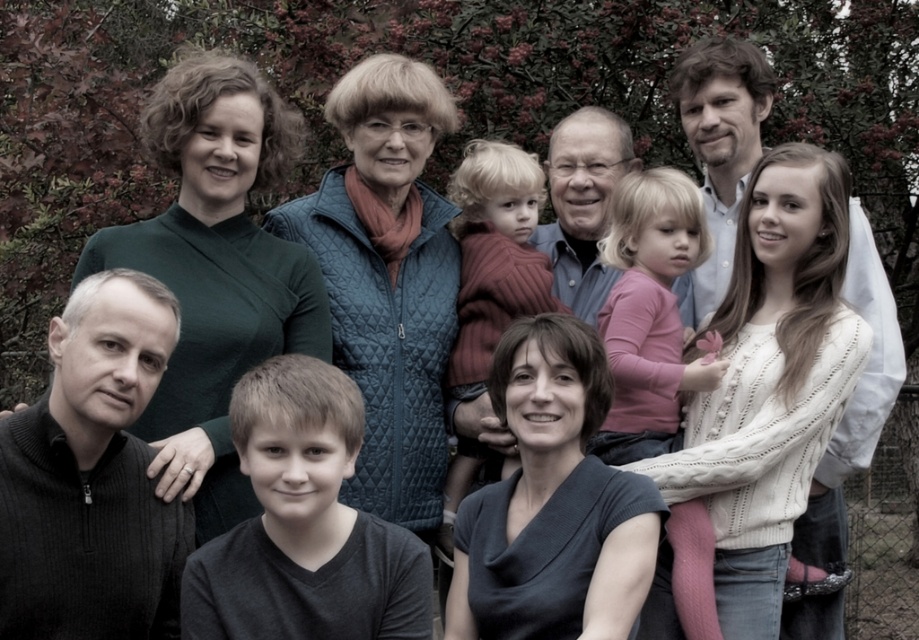
How far apart are dark gray v-neck shirt at lower left and pink sweater at center?

2.20 meters

Who is taller, dark gray v-neck shirt at lower left or pink sweater at center?

pink sweater at center

The height and width of the screenshot is (640, 919). In order to click on dark gray v-neck shirt at lower left in this screenshot , I will do `click(304, 524)`.

Is dark gray v-neck shirt at lower left positioned before maroon knitted sweater at center?

Yes, it is.

Between dark gray v-neck shirt at lower left and maroon knitted sweater at center, which one appears on the left side from the viewer's perspective?

dark gray v-neck shirt at lower left is more to the left.

Is point (271, 452) less distant than point (472, 445)?

That is True.

The height and width of the screenshot is (640, 919). What are the coordinates of `dark gray v-neck shirt at lower left` in the screenshot? It's located at (304, 524).

Which is in front, point (600, 257) or point (457, 216)?

Point (600, 257) is in front.

Can you confirm if pink sweater at center is positioned to the right of maroon knitted sweater at center?

Correct, you'll find pink sweater at center to the right of maroon knitted sweater at center.

Image resolution: width=919 pixels, height=640 pixels. Identify the location of pink sweater at center. (649, 312).